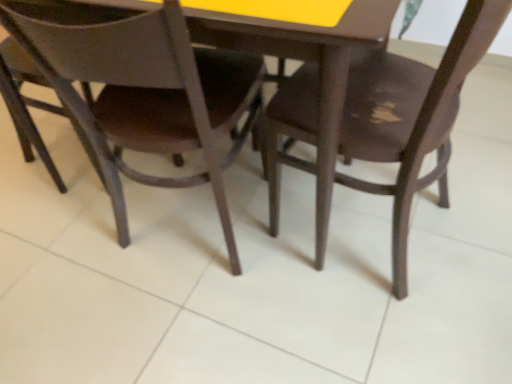
Locate an element on the screen. The width and height of the screenshot is (512, 384). free spot to the left of matte brown chair at center, the 1th chair positioned from the left is located at coordinates (61, 270).